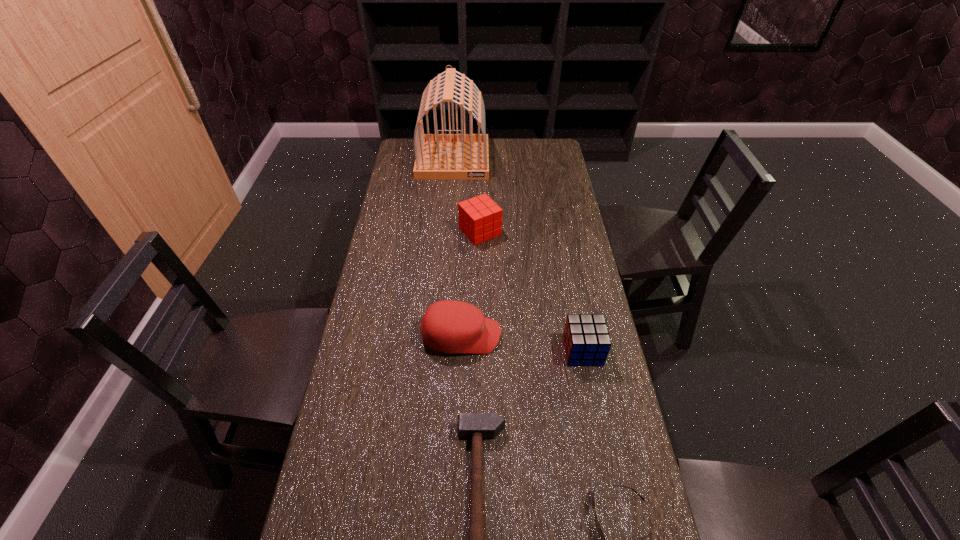
Where is `object situated at the far edge`? object situated at the far edge is located at coordinates (437, 156).

What are the coordinates of `object located at the left edge` in the screenshot? It's located at (437, 156).

Identify the location of object positioned at the right edge. The image size is (960, 540). (586, 339).

Where is `object situated at the far left corner`? object situated at the far left corner is located at coordinates (437, 156).

The width and height of the screenshot is (960, 540). I want to click on free space at the far edge of the desktop, so click(499, 156).

You are a GUI agent. You are given a task and a screenshot of the screen. Output one action in this format:
    pyautogui.click(x=<x>, y=<y>)
    Task: Click on the blank space at the left edge of the desktop
    
    Given the screenshot: What is the action you would take?
    pyautogui.click(x=367, y=430)

In the image, there is a desktop. Where is `vacant area at the right edge`? Image resolution: width=960 pixels, height=540 pixels. vacant area at the right edge is located at coordinates (578, 367).

Where is `vacant region at the far right corner of the desktop`? This screenshot has width=960, height=540. vacant region at the far right corner of the desktop is located at coordinates [556, 147].

Where is `free area in between the fifth nearest object and the nearer cube`? The height and width of the screenshot is (540, 960). free area in between the fifth nearest object and the nearer cube is located at coordinates (531, 291).

The height and width of the screenshot is (540, 960). Find the location of `vacant area that lies between the cap and the birdcage`. vacant area that lies between the cap and the birdcage is located at coordinates (457, 248).